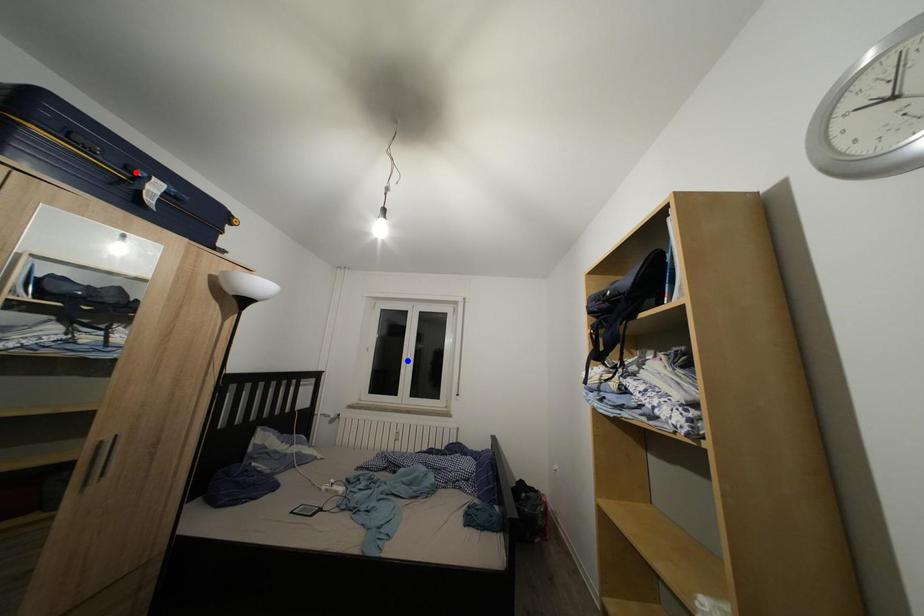
Question: Two points are marked on the image. Which point is closer to the camera?

Choices:
 (A) Blue point is closer.
 (B) Red point is closer.

Answer: (B)